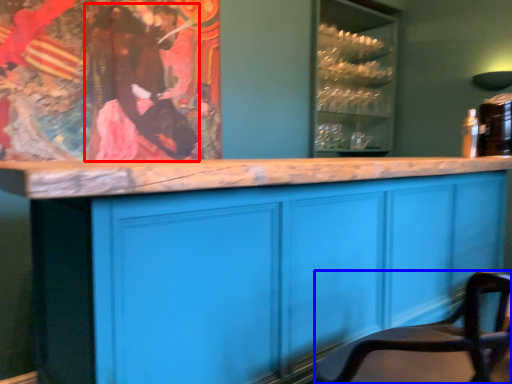
Question: Which point is further to the camera, person (highlighted by a red box) or chair (highlighted by a blue box)?

Choices:
 (A) person
 (B) chair

Answer: (A)